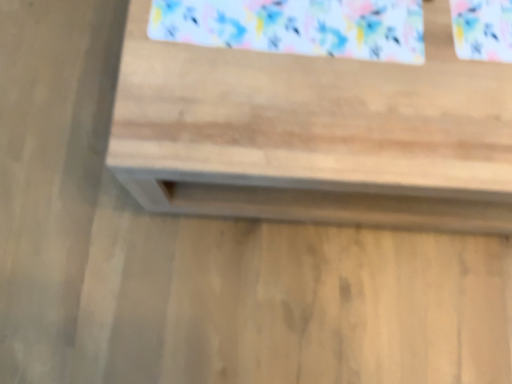
This screenshot has height=384, width=512. What are the coordinates of `natural wood table at center` in the screenshot? It's located at (315, 133).

Measure the distance between natural wood table at center and camera.

natural wood table at center and camera are 25.03 inches apart from each other.

The height and width of the screenshot is (384, 512). What do you see at coordinates (315, 133) in the screenshot?
I see `natural wood table at center` at bounding box center [315, 133].

Where is `natural wood table at center`? This screenshot has height=384, width=512. natural wood table at center is located at coordinates (315, 133).